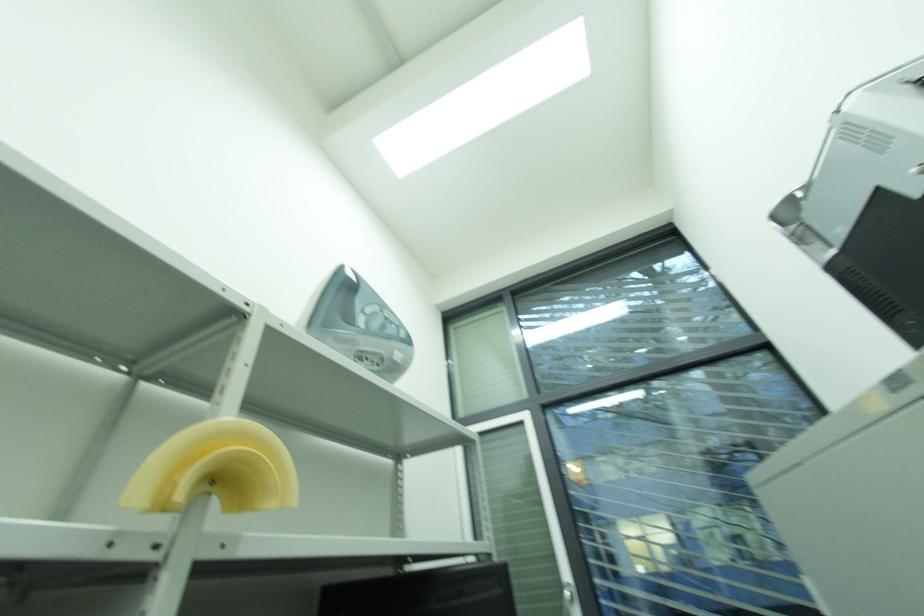
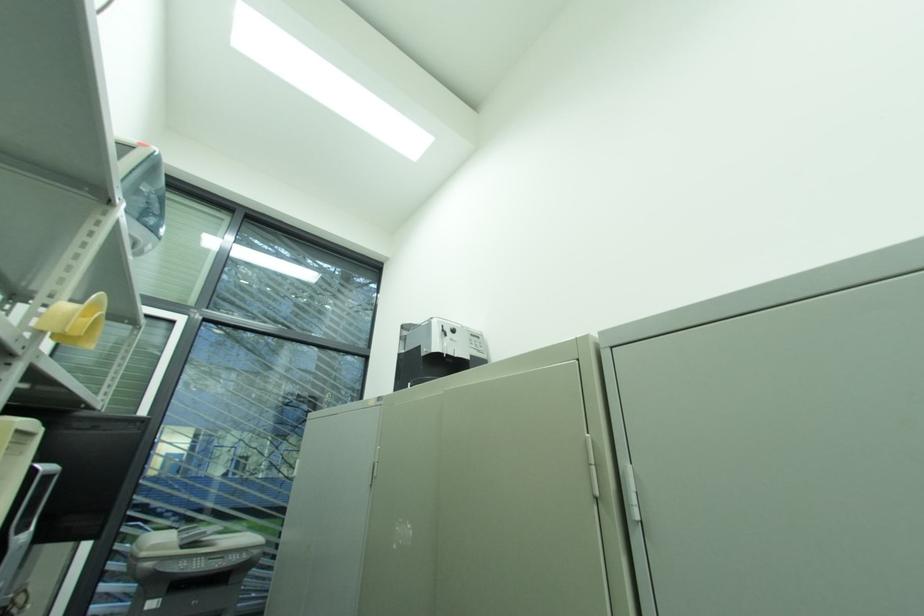
Question: The camera is either moving clockwise (left) or counter-clockwise (right) around the object. The first image is from the beginning of the video and the second image is from the end. Is the camera moving left or right when shooting the video?

Choices:
 (A) Left
 (B) Right

Answer: (A)